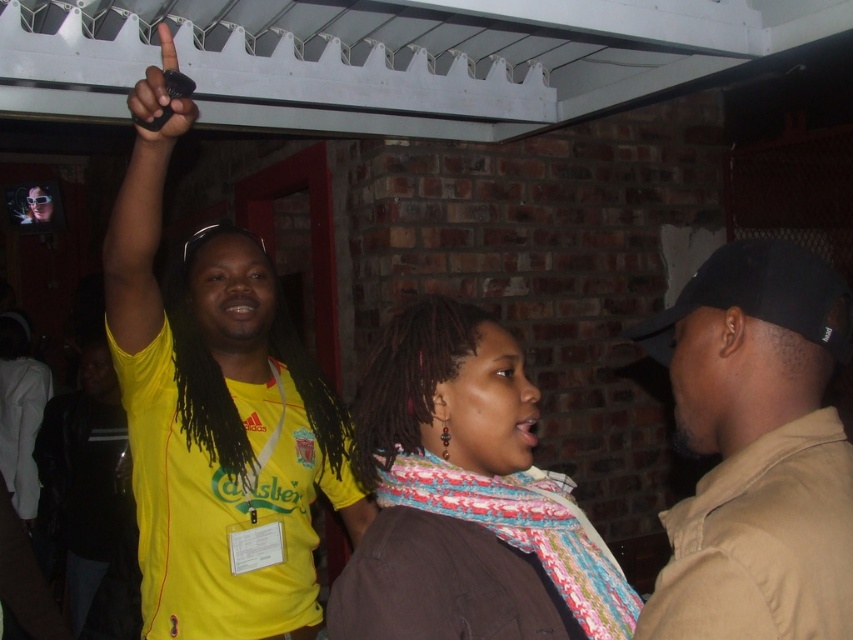
Can you confirm if black cotton cap at upper right is positioned to the right of black matte phone at upper left?

Indeed, black cotton cap at upper right is positioned on the right side of black matte phone at upper left.

Does black cotton cap at upper right have a larger size compared to black matte phone at upper left?

Yes.

The width and height of the screenshot is (853, 640). I want to click on black cotton cap at upper right, so click(x=757, y=452).

Is point (378, 474) less distant than point (187, 80)?

Yes, it is in front of point (187, 80).

Consider the image. Does multicolored scarf at center appear over black matte phone at upper left?

No.

The height and width of the screenshot is (640, 853). Find the location of `multicolored scarf at center`. multicolored scarf at center is located at coordinates (463, 499).

From the picture: Which is more to the right, yellow jersey at upper left or black cotton cap at upper right?

From the viewer's perspective, black cotton cap at upper right appears more on the right side.

What do you see at coordinates (216, 413) in the screenshot? This screenshot has width=853, height=640. I see `yellow jersey at upper left` at bounding box center [216, 413].

Who is more distant from viewer, [166,448] or [793,400]?

The point [166,448] is behind.

At what (x,y) coordinates should I click in order to perform the action: click on yellow jersey at upper left. Please return your answer as a coordinate pair (x, y). The image size is (853, 640). Looking at the image, I should click on (216, 413).